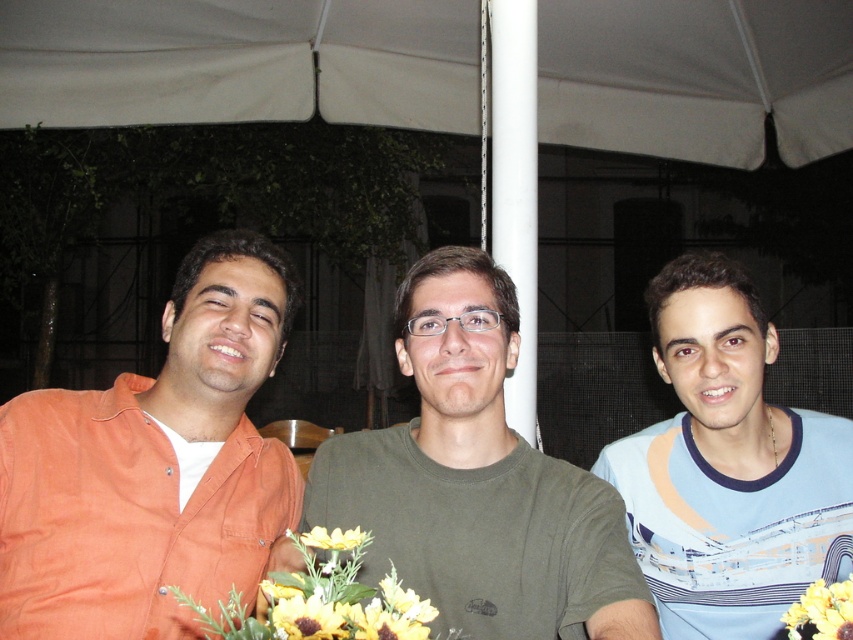
Question: Among these objects, which one is nearest to the camera?

Choices:
 (A) yellow artificial flowers at center
 (B) green matte t-shirt at center

Answer: (A)

Question: Which of the following is the farthest from the observer?

Choices:
 (A) orange cotton shirt at left
 (B) blue printed t-shirt at center
 (C) green matte t-shirt at center
 (D) yellow matte flower at center

Answer: (B)

Question: Is white fabric canopy at upper center to the right of yellow artificial flowers at center from the viewer's perspective?

Choices:
 (A) yes
 (B) no

Answer: (A)

Question: Among these points, which one is nearest to the camera?

Choices:
 (A) (850, 3)
 (B) (816, 602)

Answer: (B)

Question: Can you confirm if green matte t-shirt at center is positioned below blue printed t-shirt at center?

Choices:
 (A) yes
 (B) no

Answer: (A)

Question: Can you confirm if orange cotton shirt at left is wider than green matte t-shirt at center?

Choices:
 (A) yes
 (B) no

Answer: (B)